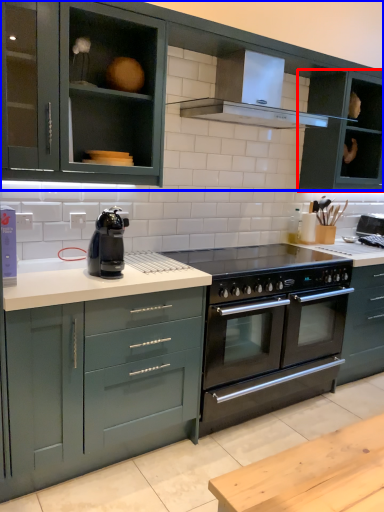
Question: Which object appears farthest to the camera in this image, cabinetry (highlighted by a red box) or cabinetry (highlighted by a blue box)?

Choices:
 (A) cabinetry
 (B) cabinetry

Answer: (A)